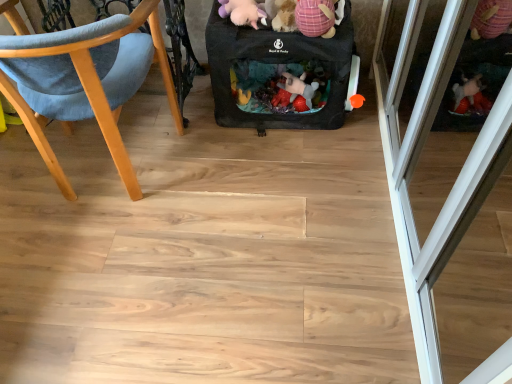
Question: Is black fabric baby carriage at center bigger or smaller than pink plaid fabric stuffed animal at upper center, positioned as the first toy in right-to-left order?

Choices:
 (A) big
 (B) small

Answer: (A)

Question: Which is correct: black fabric baby carriage at center is inside pink plaid fabric stuffed animal at upper center, the second toy viewed from the left, or outside of it?

Choices:
 (A) outside
 (B) inside

Answer: (A)

Question: Which is nearer to the purple plush toy at upper center, which is the first toy from left to right?

Choices:
 (A) black fabric baby carriage at center
 (B) transparent glass screen door at right
 (C) wooden chair at left
 (D) pink plaid fabric stuffed animal at upper center, positioned as the first toy in right-to-left order

Answer: (D)

Question: Which object is positioned closest to the pink plaid fabric stuffed animal at upper center, positioned as the first toy in right-to-left order?

Choices:
 (A) purple plush toy at upper center, which is counted as the 2th toy, starting from the right
 (B) transparent glass screen door at right
 (C) wooden chair at left
 (D) black fabric baby carriage at center

Answer: (A)